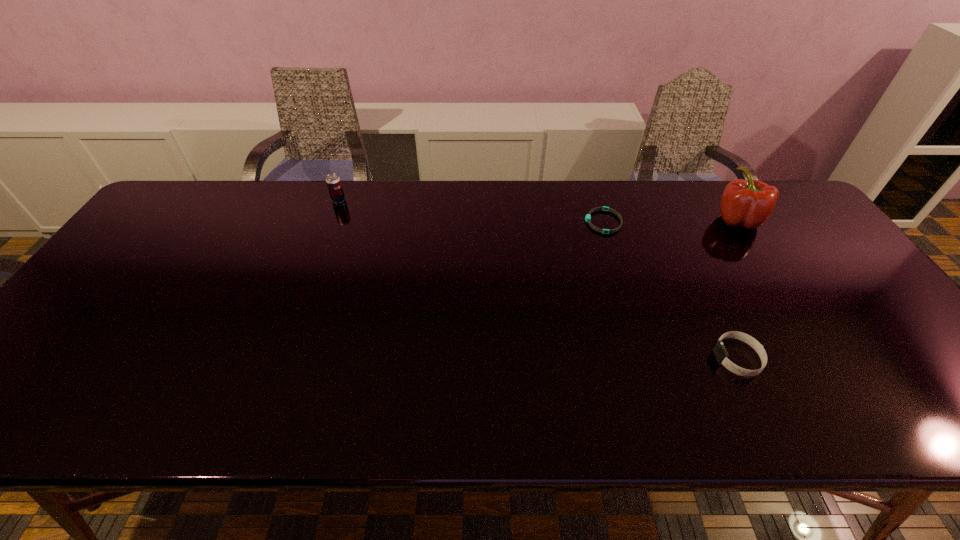
Where is `vacant space located 0.270m on the outer surface of the right wristband`? The width and height of the screenshot is (960, 540). vacant space located 0.270m on the outer surface of the right wristband is located at coordinates (596, 358).

The image size is (960, 540). What are the coordinates of `vacant space situated on the outer surface of the right wristband` in the screenshot? It's located at (640, 358).

The image size is (960, 540). Identify the location of vacant space located 0.340m on the outer surface of the right wristband. (565, 358).

This screenshot has height=540, width=960. What are the coordinates of `free spot located 0.100m on the buckle of the left wristband` in the screenshot? It's located at (552, 221).

Find the location of a particular element. The height and width of the screenshot is (540, 960). vacant space situated 0.180m on the buckle of the left wristband is located at coordinates (526, 221).

Find the location of a particular element. vacant space located 0.220m on the buckle of the left wristband is located at coordinates (513, 221).

This screenshot has height=540, width=960. Find the location of `pepper present at the far edge`. pepper present at the far edge is located at coordinates (749, 203).

Locate an element on the screen. This screenshot has width=960, height=540. beer can situated at the far edge is located at coordinates (333, 181).

Image resolution: width=960 pixels, height=540 pixels. I want to click on wristband that is at the far edge, so click(588, 217).

Find the location of a particular element. The image size is (960, 540). object that is at the right edge is located at coordinates (749, 203).